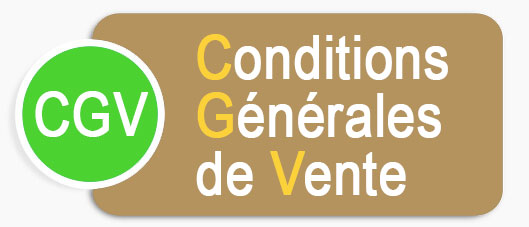
This screenshot has height=227, width=529. Identify the location of corner. (486, 16).